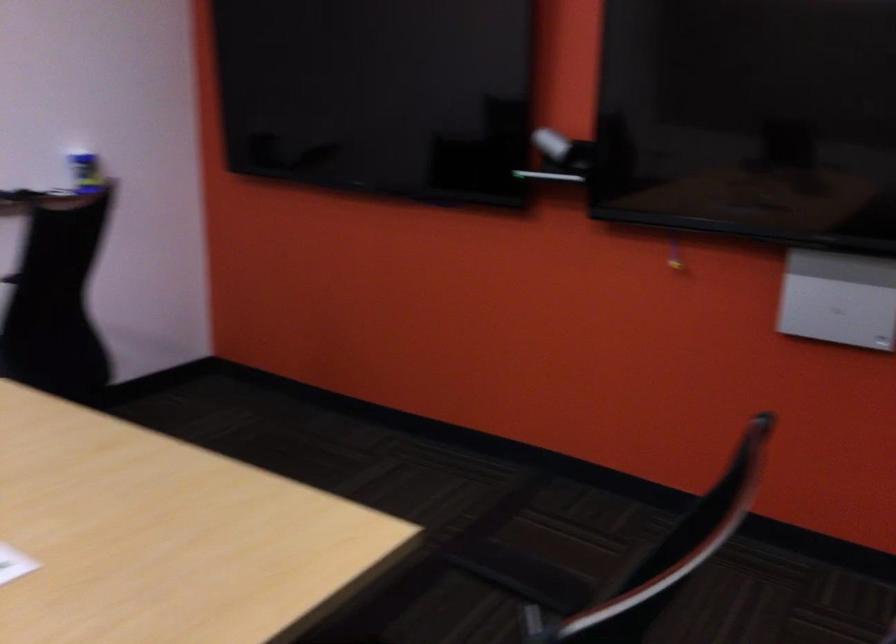
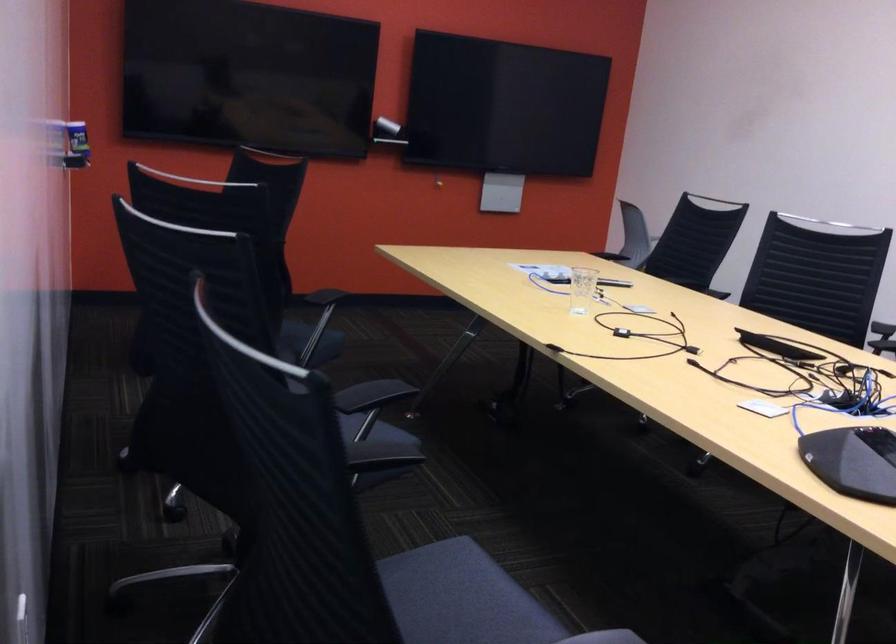
Question: I am providing you with two images of the same scene from different viewpoints. Which of the following objects are not visible in image2?

Choices:
 (A) clear drinking glass
 (B) blue spray can
 (C) black circular handle
 (D) blue and yellow can

Answer: (D)